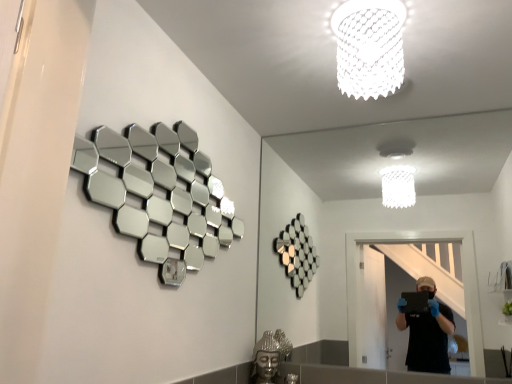
Question: Which direction should I rotate to face clear glass mirror at center, which is the second mirror in left-to-right order, — up or down?

Choices:
 (A) down
 (B) up

Answer: (A)

Question: Could you tell me if clear glass mirror at center, which ranks as the 1th mirror in right-to-left order, is turned towards silver reflective hexagonal mirrors at upper left, the first mirror when ordered from left to right?

Choices:
 (A) no
 (B) yes

Answer: (B)

Question: Is clear glass mirror at center, which is the second mirror in left-to-right order, beside silver reflective hexagonal mirrors at upper left, the first mirror when ordered from left to right?

Choices:
 (A) no
 (B) yes

Answer: (A)

Question: Would you say clear glass mirror at center, which is the second mirror in left-to-right order, is a long distance from silver reflective hexagonal mirrors at upper left, the first mirror when ordered from left to right?

Choices:
 (A) yes
 (B) no

Answer: (A)

Question: Is clear glass mirror at center, which ranks as the 1th mirror in right-to-left order, positioned with its back to silver reflective hexagonal mirrors at upper left, the first mirror when ordered from left to right?

Choices:
 (A) yes
 (B) no

Answer: (B)

Question: Does clear glass mirror at center, which is the second mirror in left-to-right order, appear on the right side of silver reflective hexagonal mirrors at upper left, which is the second mirror from right to left?

Choices:
 (A) yes
 (B) no

Answer: (A)

Question: Does clear glass mirror at center, which ranks as the 1th mirror in right-to-left order, come behind silver reflective hexagonal mirrors at upper left, the first mirror when ordered from left to right?

Choices:
 (A) yes
 (B) no

Answer: (A)

Question: Does silver reflective hexagonal mirrors at upper left, which is the second mirror from right to left, appear on the left side of silver metallic buddha head at lower center?

Choices:
 (A) yes
 (B) no

Answer: (A)

Question: Is silver metallic buddha head at lower center at the back of silver reflective hexagonal mirrors at upper left, which is the second mirror from right to left?

Choices:
 (A) no
 (B) yes

Answer: (A)

Question: From the image's perspective, is silver reflective hexagonal mirrors at upper left, which is the second mirror from right to left, located beneath silver metallic buddha head at lower center?

Choices:
 (A) no
 (B) yes

Answer: (A)

Question: Considering the relative positions of silver reflective hexagonal mirrors at upper left, which is the second mirror from right to left, and silver metallic buddha head at lower center in the image provided, is silver reflective hexagonal mirrors at upper left, which is the second mirror from right to left, in front of silver metallic buddha head at lower center?

Choices:
 (A) yes
 (B) no

Answer: (A)

Question: From a real-world perspective, is silver reflective hexagonal mirrors at upper left, which is the second mirror from right to left, on top of silver metallic buddha head at lower center?

Choices:
 (A) yes
 (B) no

Answer: (A)

Question: Is silver reflective hexagonal mirrors at upper left, the first mirror when ordered from left to right, outside silver metallic buddha head at lower center?

Choices:
 (A) no
 (B) yes

Answer: (B)

Question: Considering the relative sizes of silver reflective hexagonal mirrors at upper left, the first mirror when ordered from left to right, and white textured lampshade at upper center in the image provided, is silver reflective hexagonal mirrors at upper left, the first mirror when ordered from left to right, thinner than white textured lampshade at upper center?

Choices:
 (A) yes
 (B) no

Answer: (A)